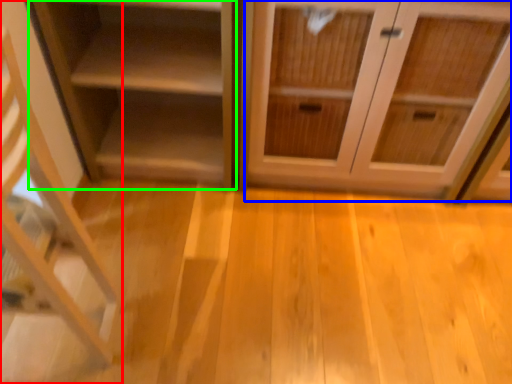
Question: Which object is the closest to the shelf (highlighted by a red box)? Choose among these: cabinetry (highlighted by a blue box) or shelf (highlighted by a green box).

Choices:
 (A) cabinetry
 (B) shelf

Answer: (B)